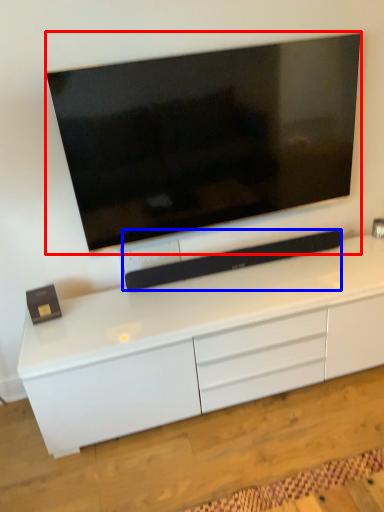
Question: Which point is further to the camera, television (highlighted by a red box) or equipment (highlighted by a blue box)?

Choices:
 (A) television
 (B) equipment

Answer: (B)